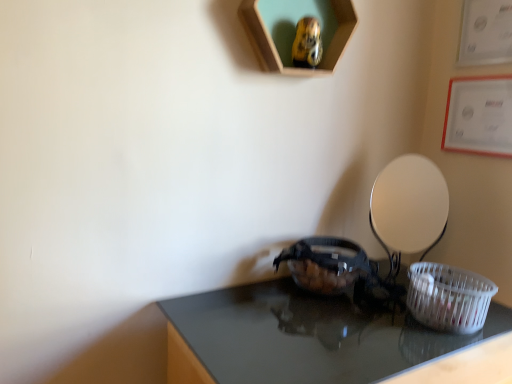
This screenshot has height=384, width=512. Identify the location of free point to the left of white plastic basket at lower right. (376, 325).